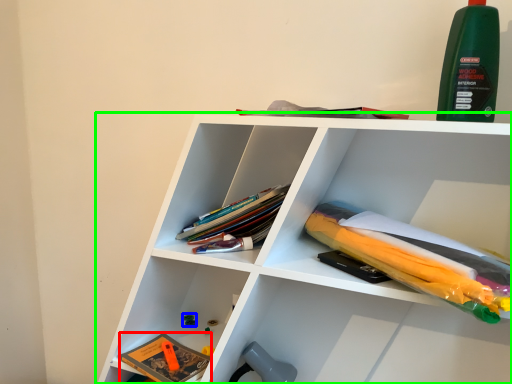
Question: Considering the real-world distances, which object is closest to book (highlighted by a red box)? toy (highlighted by a blue box) or shelf (highlighted by a green box).

Choices:
 (A) toy
 (B) shelf

Answer: (A)